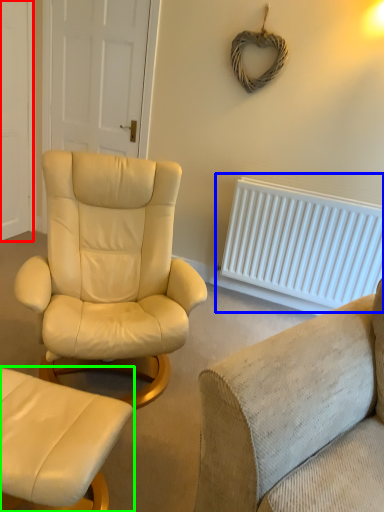
Question: Based on their relative distances, which object is farther from door (highlighted by a red box)? Choose from radiator (highlighted by a blue box) and chair (highlighted by a green box).

Choices:
 (A) radiator
 (B) chair

Answer: (B)